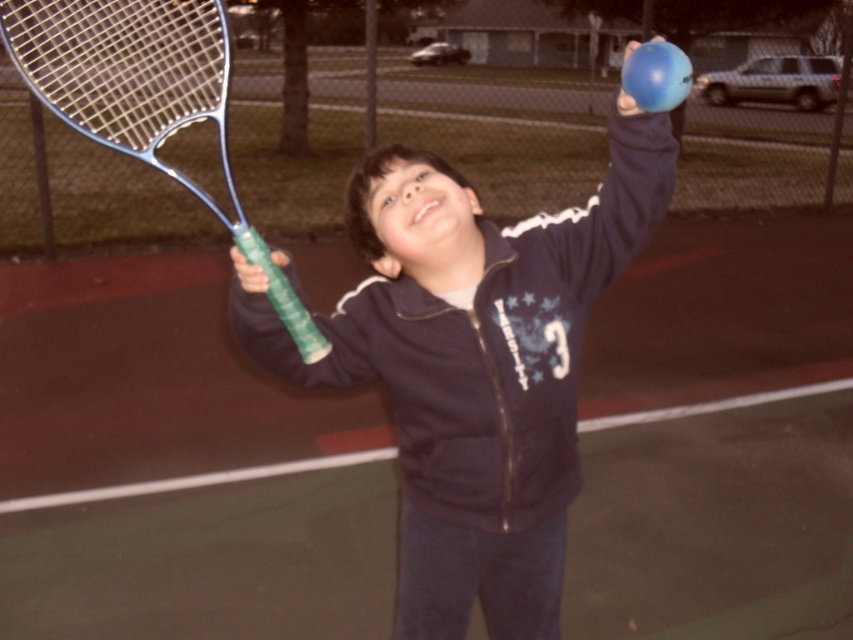
Does blue metallic tennis racket at left have a lesser height compared to blue rubber ball at upper right?

Yes, blue metallic tennis racket at left is shorter than blue rubber ball at upper right.

Does blue metallic tennis racket at left appear under blue rubber ball at upper right?

Correct, blue metallic tennis racket at left is located below blue rubber ball at upper right.

Which is in front, point (161, 54) or point (622, 106)?

Point (622, 106) is more forward.

Locate an element on the screen. The image size is (853, 640). blue metallic tennis racket at left is located at coordinates (144, 97).

Who is lower down, green rubber tennis court at center or blue metallic tennis racket at left?

Positioned lower is green rubber tennis court at center.

Consider the image. Which is more to the left, green rubber tennis court at center or blue metallic tennis racket at left?

green rubber tennis court at center is more to the left.

This screenshot has height=640, width=853. Describe the element at coordinates (149, 380) in the screenshot. I see `green rubber tennis court at center` at that location.

The width and height of the screenshot is (853, 640). Identify the location of green rubber tennis court at center. (149, 380).

Does matte blue ball at upper right have a greater height compared to blue metallic tennis racket at left?

Incorrect, matte blue ball at upper right's height is not larger of blue metallic tennis racket at left's.

Describe the element at coordinates (473, 365) in the screenshot. The image size is (853, 640). I see `matte blue ball at upper right` at that location.

At what (x,y) coordinates should I click in order to perform the action: click on matte blue ball at upper right. Please return your answer as a coordinate pair (x, y). Looking at the image, I should click on (473, 365).